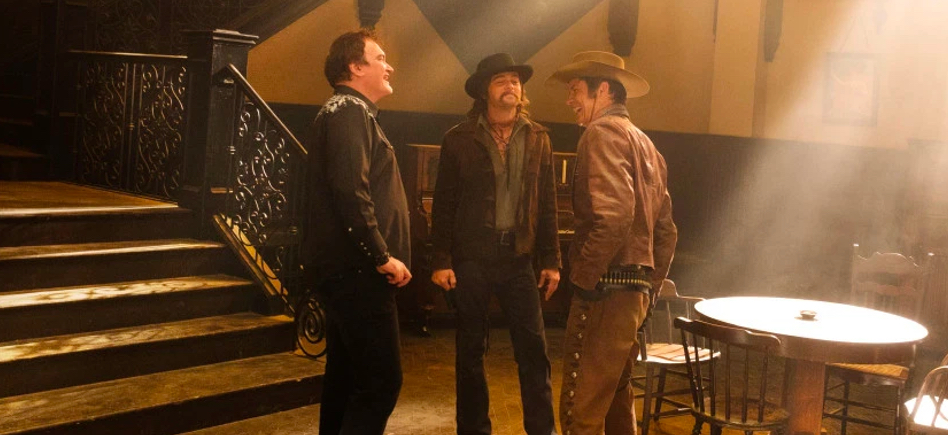
You are a GUI agent. You are given a task and a screenshot of the screen. Output one action in this format:
    pyautogui.click(x=<x>, y=<y>)
    Task: Click on the white table top
    The image size is (948, 435).
    Given the screenshot: What is the action you would take?
    pyautogui.click(x=753, y=316), pyautogui.click(x=753, y=330)